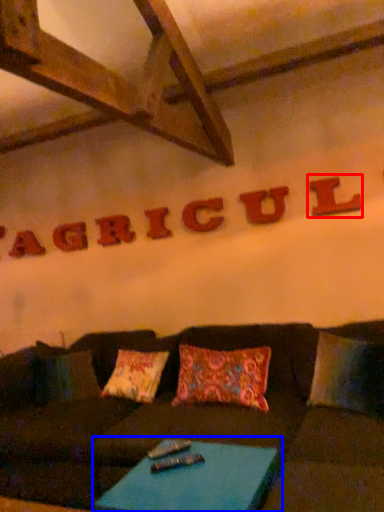
Question: Which object appears closest to the camera in this image, letter (highlighted by a red box) or table (highlighted by a blue box)?

Choices:
 (A) letter
 (B) table

Answer: (B)